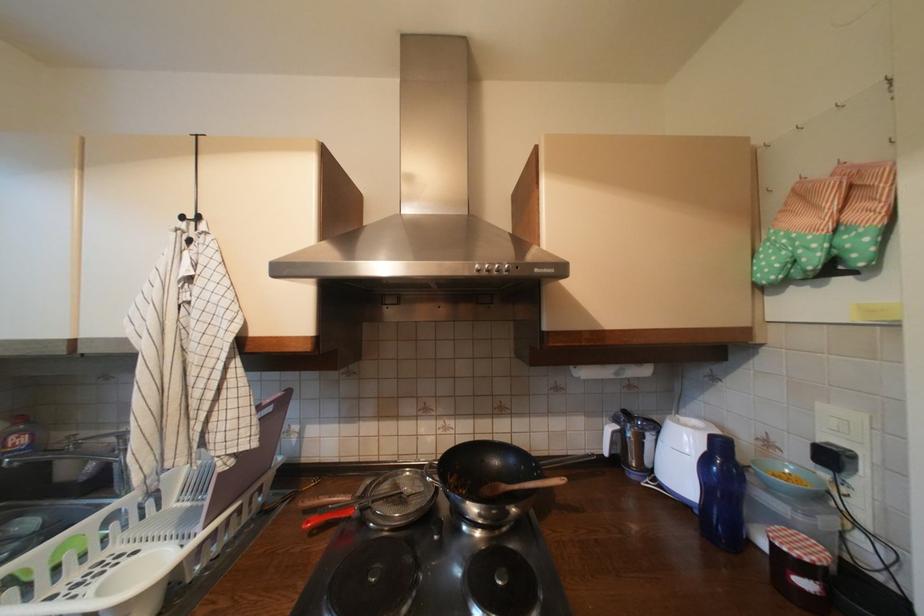
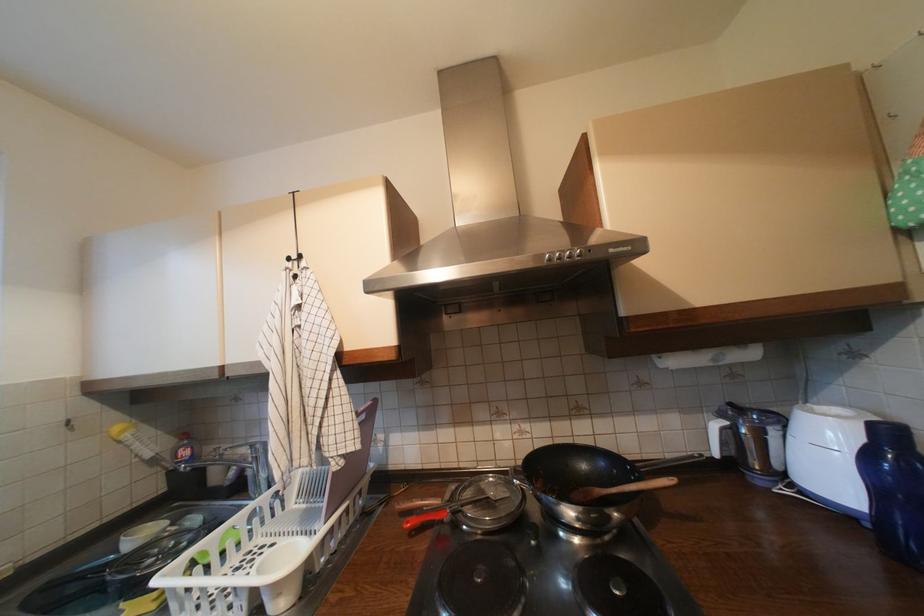
Where in the second image is the point corresponding to pixel 525 488 from the first image?

(623, 492)